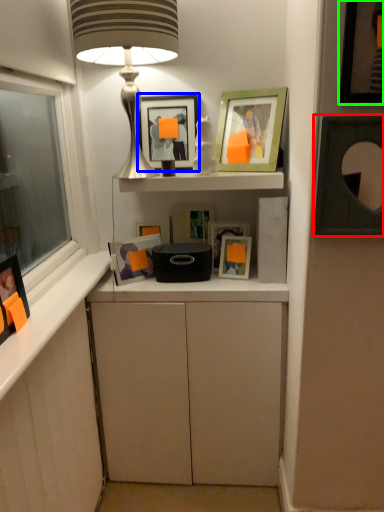
Question: Which object is positioned farthest from picture frame (highlighted by a red box)? Select from picture frame (highlighted by a blue box) and picture frame (highlighted by a green box).

Choices:
 (A) picture frame
 (B) picture frame

Answer: (A)